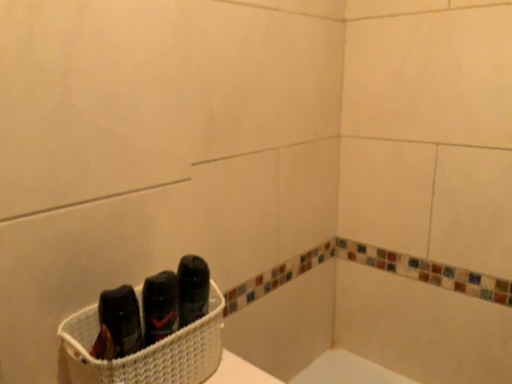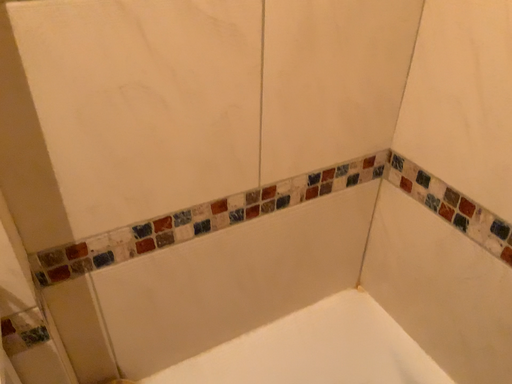
Question: Which way did the camera rotate in the video?

Choices:
 (A) rotated upward
 (B) rotated downward

Answer: (B)